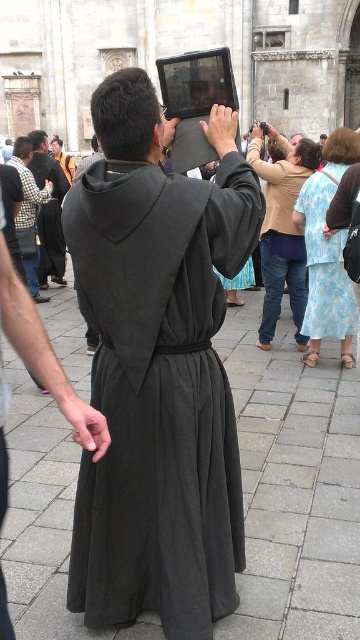
Is matte black robe at center to the left of floral fabric dress at lower right from the viewer's perspective?

Indeed, matte black robe at center is positioned on the left side of floral fabric dress at lower right.

Is matte black robe at center further to the viewer compared to floral fabric dress at lower right?

No, it is in front of floral fabric dress at lower right.

Between point (189, 252) and point (309, 257), which one is positioned in front?

Point (189, 252) is more forward.

What are the coordinates of `matte black robe at center` in the screenshot? It's located at (159, 394).

In the scene shown: Which is above, light brown fabric blouse at upper center or light brown fabric dress at center?

Positioned higher is light brown fabric dress at center.

Describe the element at coordinates (281, 228) in the screenshot. I see `light brown fabric blouse at upper center` at that location.

Based on the photo, who is more distant from viewer, (276,285) or (59,141)?

Positioned behind is point (59,141).

Identify the location of light brown fabric blouse at upper center. The width and height of the screenshot is (360, 640). (281, 228).

Image resolution: width=360 pixels, height=640 pixels. Find the location of `dark gray robe at center`. dark gray robe at center is located at coordinates (48, 211).

Between point (41, 170) and point (28, 198), which one is positioned in front?

Point (28, 198)

Where is `dark gray robe at center`? dark gray robe at center is located at coordinates (48, 211).